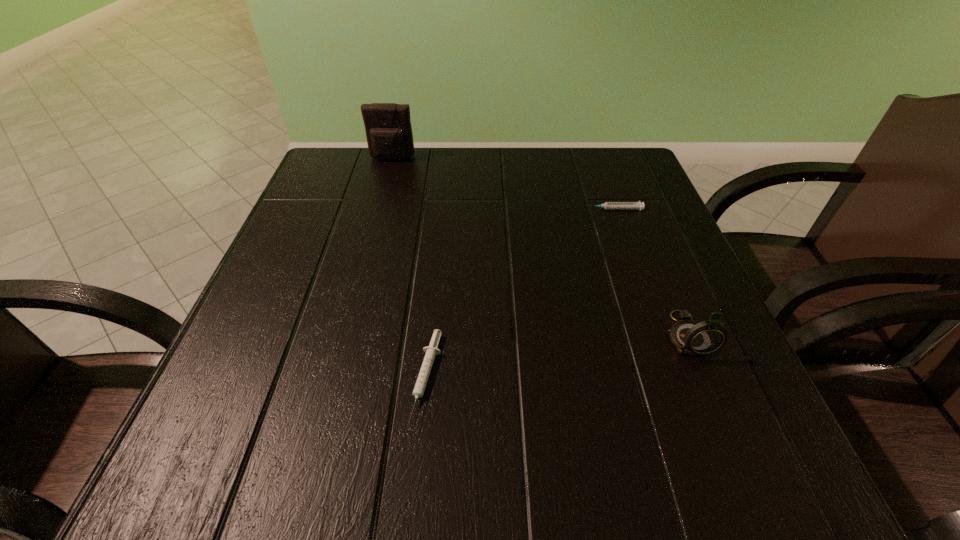
At what (x,y) coordinates should I click in order to perform the action: click on the tallest object. Please return your answer as a coordinate pair (x, y). Image resolution: width=960 pixels, height=540 pixels. Looking at the image, I should click on (388, 128).

Find the location of a particular element. pouch is located at coordinates (388, 128).

Image resolution: width=960 pixels, height=540 pixels. Identify the location of the second tallest object. (690, 337).

Find the location of `the right syringe`. the right syringe is located at coordinates (607, 205).

Identify the location of the second farthest object. The height and width of the screenshot is (540, 960). (607, 205).

You are a GUI agent. You are given a task and a screenshot of the screen. Output one action in this format:
    pyautogui.click(x=<x>, y=<y>)
    Task: Click on the nearer syringe
    
    Given the screenshot: What is the action you would take?
    pyautogui.click(x=431, y=351)

Locate an element on the screen. Image resolution: width=960 pixels, height=540 pixels. the third object from right to left is located at coordinates (431, 351).

You are a GUI agent. You are given a task and a screenshot of the screen. Output one action in this format:
    pyautogui.click(x=<x>, y=<y>)
    Task: Click on the blank space located 0.070m with an open flap on the farthest object
    The image size is (960, 540).
    Given the screenshot: What is the action you would take?
    pyautogui.click(x=387, y=179)

The width and height of the screenshot is (960, 540). I want to click on vacant space situated 0.170m on the face of the compass, so click(745, 474).

Identify the location of free space located 0.120m at the needle end of the right syringe. click(530, 209).